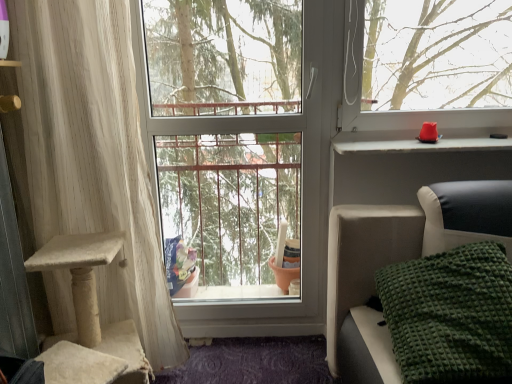
Question: From the image's perspective, would you say green textured blanket at lower right is shown under transparent glass window at center?

Choices:
 (A) yes
 (B) no

Answer: (A)

Question: Does green textured blanket at lower right contain transparent glass window at center?

Choices:
 (A) yes
 (B) no

Answer: (B)

Question: Considering the relative positions of green textured blanket at lower right and transparent glass window at center in the image provided, is green textured blanket at lower right behind transparent glass window at center?

Choices:
 (A) no
 (B) yes

Answer: (A)

Question: Can you confirm if green textured blanket at lower right is shorter than transparent glass window at center?

Choices:
 (A) no
 (B) yes

Answer: (B)

Question: Considering the relative positions of green textured blanket at lower right and transparent glass window at center in the image provided, is green textured blanket at lower right to the left of transparent glass window at center from the viewer's perspective?

Choices:
 (A) no
 (B) yes

Answer: (A)

Question: Is green textured blanket at lower right facing towards transparent glass window at center?

Choices:
 (A) no
 (B) yes

Answer: (A)

Question: Is white textured curtain at left aimed at matte plastic window sill at upper right?

Choices:
 (A) no
 (B) yes

Answer: (A)

Question: Can you confirm if white textured curtain at left is bigger than matte plastic window sill at upper right?

Choices:
 (A) yes
 (B) no

Answer: (A)

Question: Can you confirm if white textured curtain at left is wider than matte plastic window sill at upper right?

Choices:
 (A) no
 (B) yes

Answer: (A)

Question: Is the position of white textured curtain at left more distant than that of matte plastic window sill at upper right?

Choices:
 (A) yes
 (B) no

Answer: (B)

Question: From a real-world perspective, is white textured curtain at left physically below matte plastic window sill at upper right?

Choices:
 (A) yes
 (B) no

Answer: (A)

Question: Is white textured curtain at left located outside matte plastic window sill at upper right?

Choices:
 (A) yes
 (B) no

Answer: (A)

Question: Is the depth of white textured curtain at left greater than that of transparent glass window at center?

Choices:
 (A) no
 (B) yes

Answer: (A)